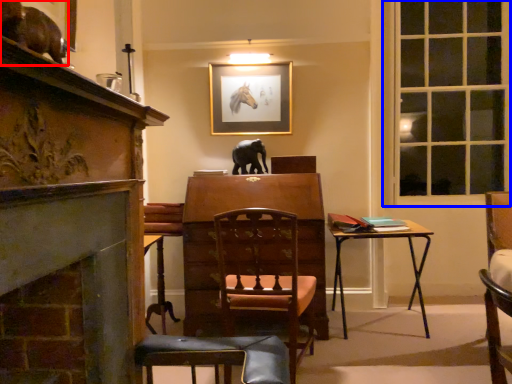
Question: Which object appears closest to the camera in this image, animal (highlighted by a red box) or window (highlighted by a blue box)?

Choices:
 (A) animal
 (B) window

Answer: (A)